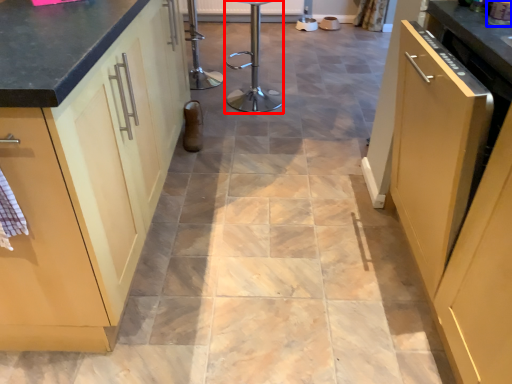
Question: Which point is closer to the camera, bar stool (highlighted by a red box) or appliance (highlighted by a blue box)?

Choices:
 (A) bar stool
 (B) appliance

Answer: (B)